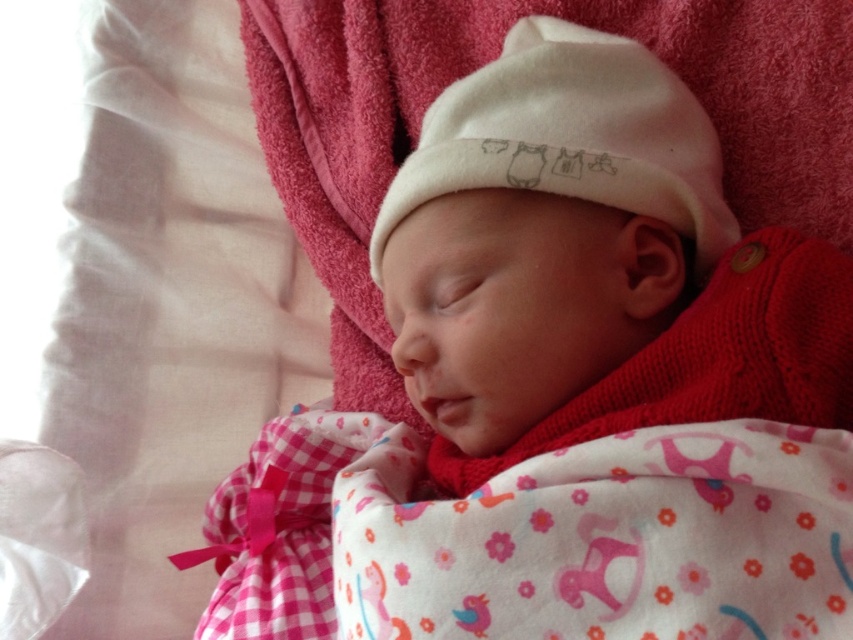
Question: Does white soft hat at center appear over white cotton hat at center?

Choices:
 (A) yes
 (B) no

Answer: (B)

Question: Among these points, which one is nearest to the camera?

Choices:
 (A) (589, 81)
 (B) (537, 397)

Answer: (B)

Question: Does white soft hat at center lie in front of white cotton hat at center?

Choices:
 (A) yes
 (B) no

Answer: (A)

Question: Which object is farther from the camera taking this photo?

Choices:
 (A) white cotton hat at center
 (B) white soft hat at center

Answer: (A)

Question: Can you confirm if white soft hat at center is positioned above white cotton hat at center?

Choices:
 (A) no
 (B) yes

Answer: (A)